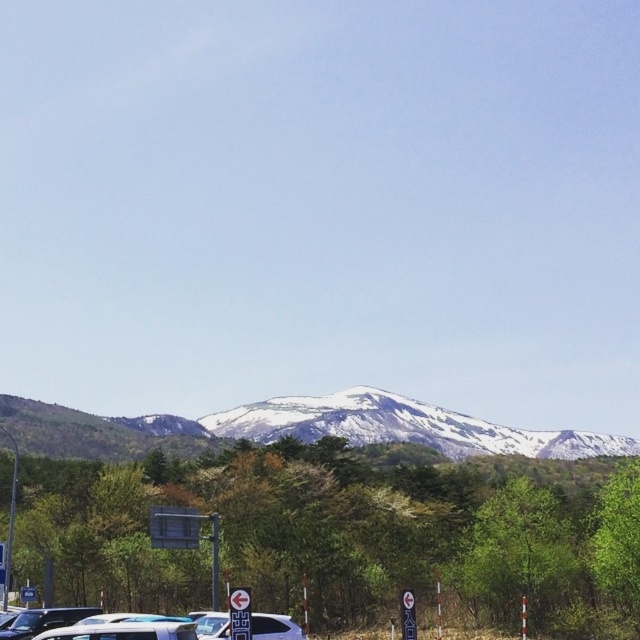
Is point (209, 612) closer to viewer compared to point (256, 634)?

That is False.

Which is behind, point (218, 621) or point (282, 621)?

Point (282, 621)

Where is `metallic silver car at lower center`? metallic silver car at lower center is located at coordinates (170, 621).

Does metallic silver car at lower center appear on the left side of metallic silver car at lower left?

In fact, metallic silver car at lower center is to the right of metallic silver car at lower left.

Who is more distant from viewer, [260,618] or [20,618]?

Positioned behind is point [20,618].

Describe the element at coordinates (170, 621) in the screenshot. I see `metallic silver car at lower center` at that location.

Find the location of a particular element. The width and height of the screenshot is (640, 640). metallic silver car at lower center is located at coordinates (170, 621).

Locate an element on the screen. green leafy park at lower center is located at coordinates (348, 536).

Is point (250, 460) farther from viewer compared to point (51, 419)?

No, it is not.

Does point (608, 563) come in front of point (364, 436)?

That is True.

Locate an element on the screen. This screenshot has height=640, width=640. green leafy park at lower center is located at coordinates (348, 536).